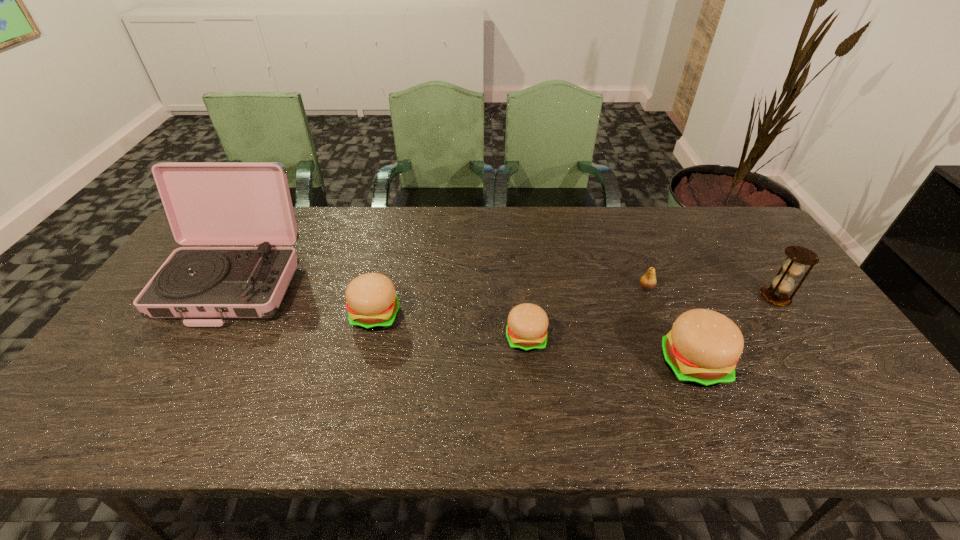
Find the location of `vacant space located on the right of the third object from left to right`. vacant space located on the right of the third object from left to right is located at coordinates (678, 338).

You are a GUI agent. You are given a task and a screenshot of the screen. Output one action in this format:
    pyautogui.click(x=<x>, y=<y>)
    Task: Click on the free space located 0.330m on the back of the rightmost hamburger
    
    Given the screenshot: What is the action you would take?
    pyautogui.click(x=646, y=255)

Where is `vacant region located on the left of the pear`? Image resolution: width=960 pixels, height=540 pixels. vacant region located on the left of the pear is located at coordinates (556, 288).

Find the location of a particular element. vacant area located 0.120m with the lid open on the leftmost object is located at coordinates (184, 368).

Where is `vacant space situated 0.210m on the left of the hourglass`? The width and height of the screenshot is (960, 540). vacant space situated 0.210m on the left of the hourglass is located at coordinates (686, 298).

This screenshot has width=960, height=540. In order to click on object at the far edge in this screenshot , I will do `click(207, 203)`.

Identify the location of object that is at the near edge. The width and height of the screenshot is (960, 540). (702, 349).

Where is `object located in the left edge section of the desktop`? object located in the left edge section of the desktop is located at coordinates (207, 203).

The height and width of the screenshot is (540, 960). What are the coordinates of `object that is at the right edge` in the screenshot? It's located at (797, 256).

I want to click on object situated at the far left corner, so click(207, 203).